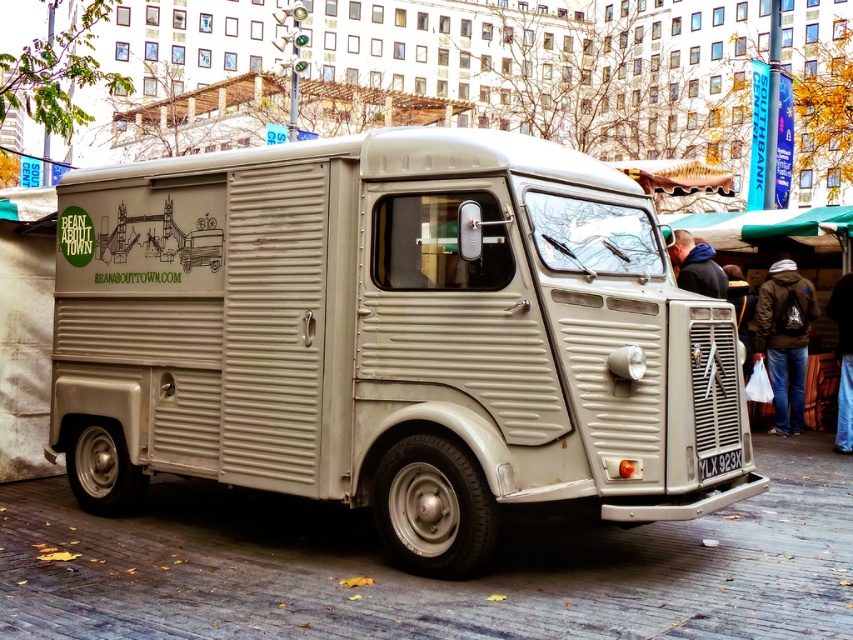
Question: Considering the real-world distances, which object is farthest from the dark brown backpack at lower right?

Choices:
 (A) matte beige van at center
 (B) blue fleece jacket at upper right
 (C) denim pants at lower right

Answer: (A)

Question: Does matte beige van at center have a greater width compared to blue fleece jacket at upper right?

Choices:
 (A) no
 (B) yes

Answer: (B)

Question: Which of these objects is positioned closest to the dark brown backpack at lower right?

Choices:
 (A) denim pants at lower right
 (B) blue fleece jacket at upper right

Answer: (A)

Question: Can you confirm if dark brown backpack at lower right is positioned to the right of denim pants at lower right?

Choices:
 (A) no
 (B) yes

Answer: (A)

Question: Is matte beige van at center in front of denim pants at lower right?

Choices:
 (A) no
 (B) yes

Answer: (B)

Question: Which point is closer to the camera taking this photo?

Choices:
 (A) (851, 433)
 (B) (94, 195)
 (C) (796, 328)
 (D) (721, 298)

Answer: (B)